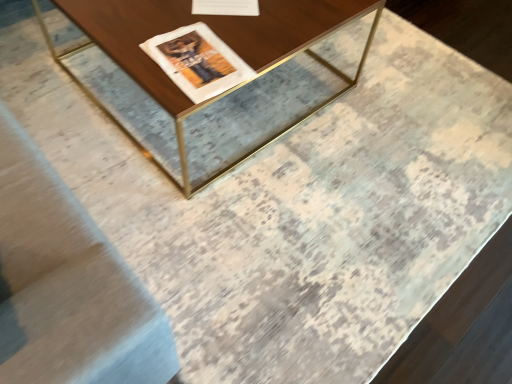
The width and height of the screenshot is (512, 384). What are the coordinates of `space that is in front of matte gold table at center` in the screenshot? It's located at (231, 233).